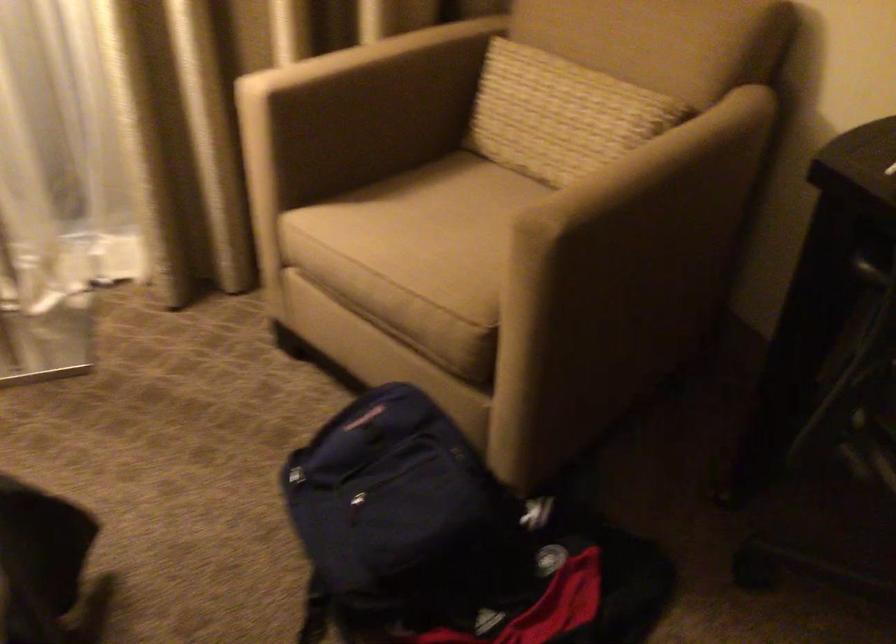
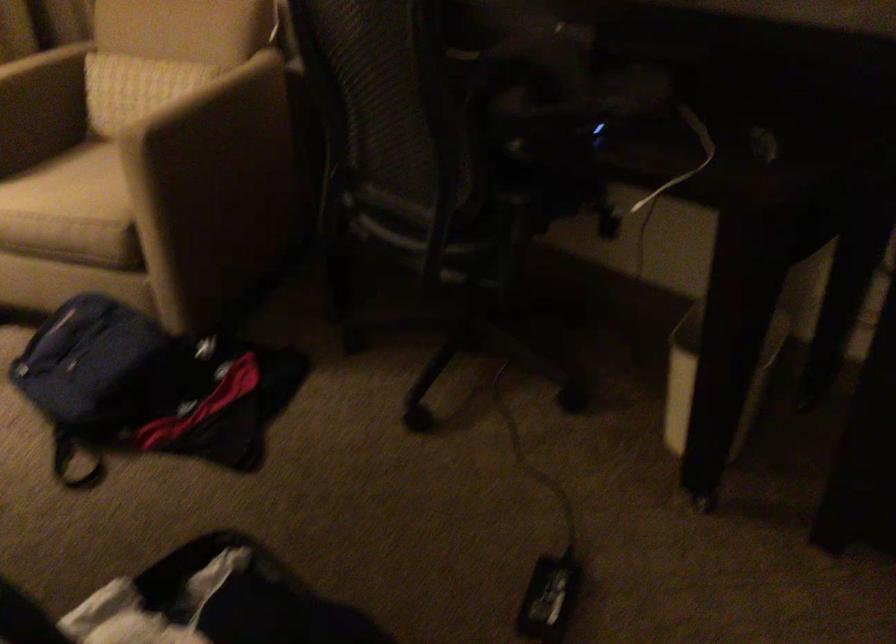
Question: Which direction would the cameraman need to move to produce the second image? Reply with the corresponding letter.

Choices:
 (A) Left
 (B) Right
 (C) Forward
 (D) Backward

Answer: (D)